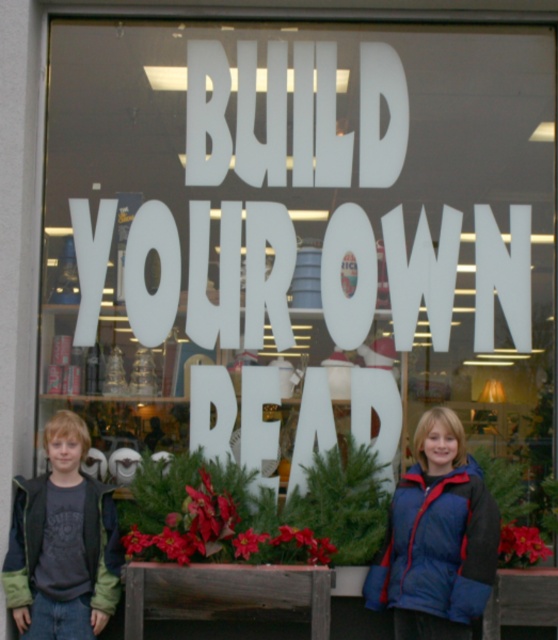
Question: Can you confirm if blue down jacket at lower right is thinner than green fleece jacket at lower left?

Choices:
 (A) yes
 (B) no

Answer: (B)

Question: Which point is closer to the camera?

Choices:
 (A) green fleece jacket at lower left
 (B) blue down jacket at lower right

Answer: (B)

Question: Among these objects, which one is nearest to the camera?

Choices:
 (A) blue down jacket at lower right
 (B) green fleece jacket at lower left

Answer: (A)

Question: Is blue down jacket at lower right above green fleece jacket at lower left?

Choices:
 (A) no
 (B) yes

Answer: (B)

Question: Is blue down jacket at lower right further to the viewer compared to green fleece jacket at lower left?

Choices:
 (A) yes
 (B) no

Answer: (B)